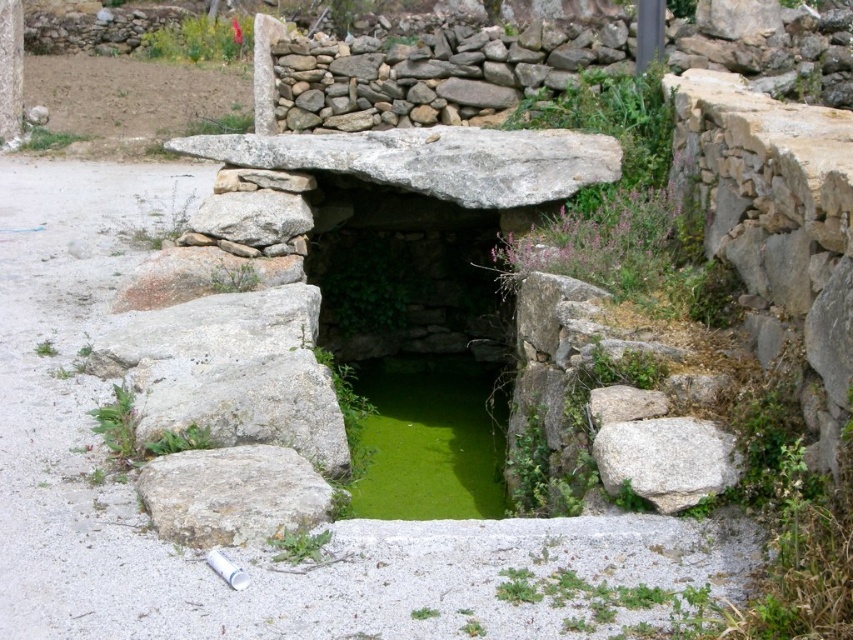
You are standing in front of an ancient stone structure with a rectangular opening filled with greenish water. There is a point labeled as point (x=427, y=440). What is the significance of this point in relation to the green algae at center?

The point (x=427, y=440) represents the location of the green algae at center in the image.

You are a small animal trying to jump from the gray rough stone at lower left to the gray rough rock at right. Can you make the jump if your maximum jump distance is 3.5 feet?

The distance between the gray rough stone at lower left and the gray rough rock at right is 4.08 feet, which is greater than your maximum jump distance of 3.5 feet. You cannot make the jump.

You are standing in front of an ancient stone structure and notice two objects of interest. You want to touch both the green algae at center and the gray rough stone at lower left. Which object will you need to reach out further to touch?

The gray rough stone at lower left is further away from you than the green algae at center, so you will need to reach out further to touch the gray rough stone at lower left.